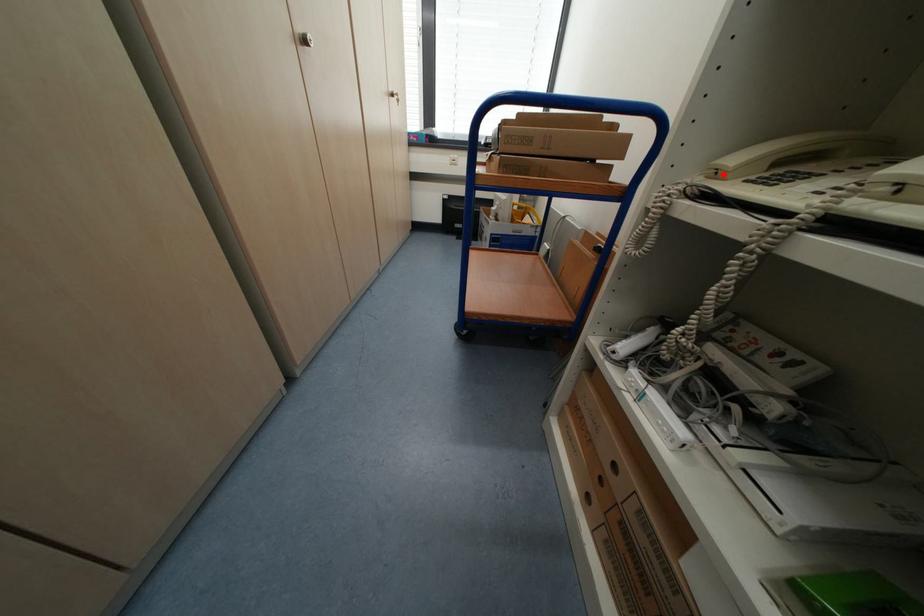
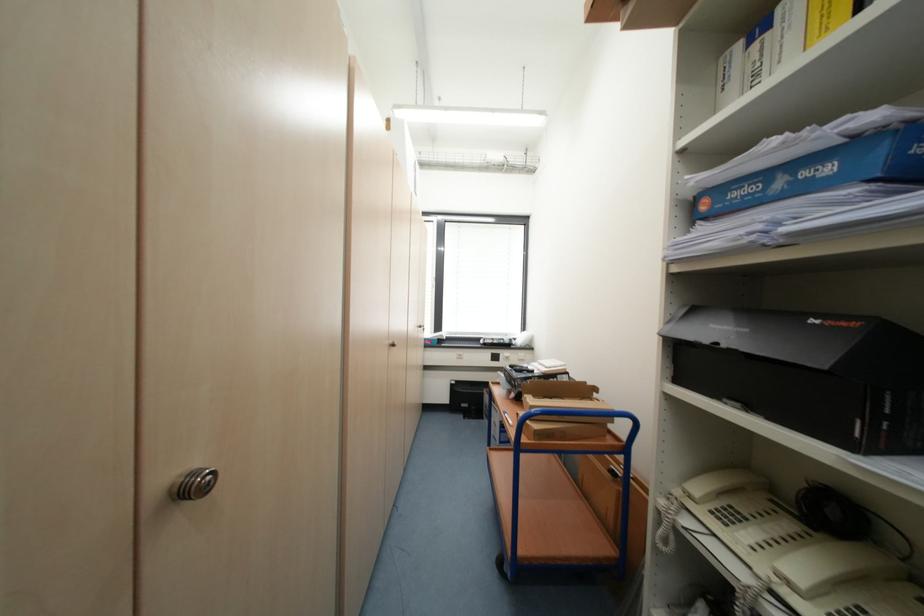
Where in the second image is the point corresponding to the highlighted location from the first image?

(697, 498)